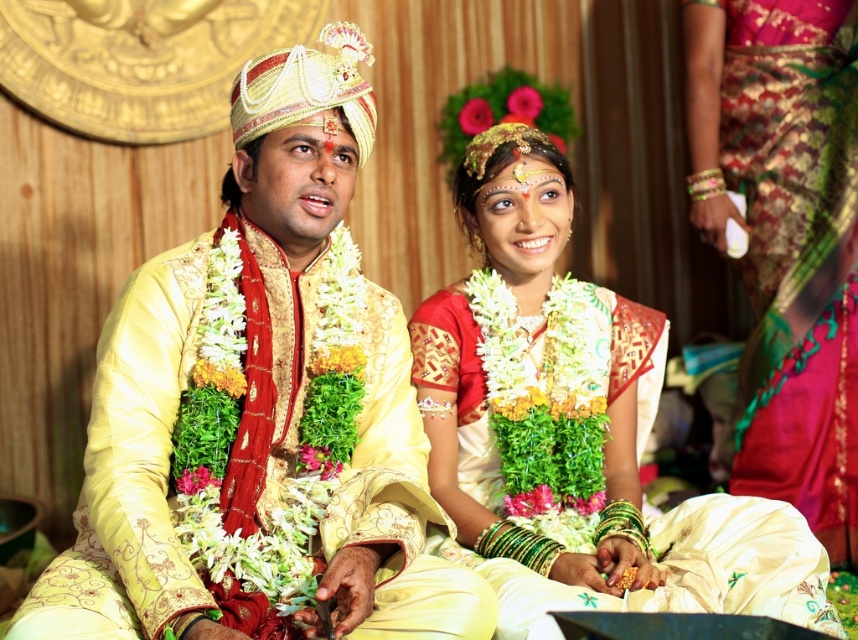
Question: Does matte gold saree at center lie in front of silky pink saree at right?

Choices:
 (A) yes
 (B) no

Answer: (A)

Question: Which object is the closest to the matte gold saree at center?

Choices:
 (A) silky pink saree at right
 (B) matte gold kurta at center

Answer: (B)

Question: Does matte gold saree at center appear under silky pink saree at right?

Choices:
 (A) yes
 (B) no

Answer: (A)

Question: Is matte gold kurta at center smaller than matte gold saree at center?

Choices:
 (A) no
 (B) yes

Answer: (B)

Question: Which point is farther to the camera?

Choices:
 (A) (x=776, y=129)
 (B) (x=530, y=147)
 (C) (x=303, y=241)

Answer: (A)

Question: Which point is closer to the camera?

Choices:
 (A) (571, 202)
 (B) (750, 12)

Answer: (A)